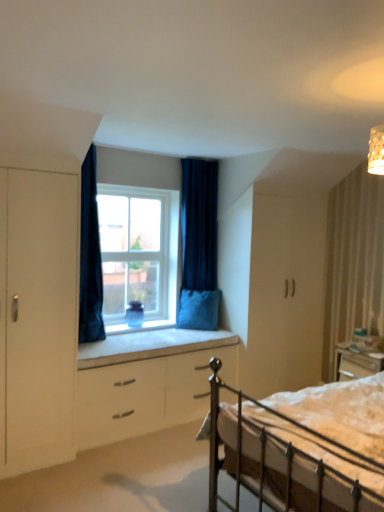
Question: From the image's perspective, is velvet dark blue curtain at center, which is the first curtain from back to front, above white cushioned window sill at center?

Choices:
 (A) no
 (B) yes

Answer: (B)

Question: Can you confirm if velvet dark blue curtain at center, the first curtain viewed from the right, is wider than white cushioned window sill at center?

Choices:
 (A) yes
 (B) no

Answer: (B)

Question: Could white cushioned window sill at center be considered to be inside velvet dark blue curtain at center, which is counted as the 2th curtain, starting from the front?

Choices:
 (A) yes
 (B) no

Answer: (B)

Question: Does velvet dark blue curtain at center, the second curtain from the left, have a greater height compared to white cushioned window sill at center?

Choices:
 (A) yes
 (B) no

Answer: (A)

Question: Is velvet dark blue curtain at center, which is the first curtain from back to front, oriented towards white cushioned window sill at center?

Choices:
 (A) no
 (B) yes

Answer: (A)

Question: Is velvet dark blue curtain at center, which is the first curtain from back to front, looking in the opposite direction of white cushioned window sill at center?

Choices:
 (A) yes
 (B) no

Answer: (B)

Question: Does metallic silver bed at lower right lie behind velvet dark blue curtain at center, the second curtain from the left?

Choices:
 (A) yes
 (B) no

Answer: (B)

Question: Is metallic silver bed at lower right taller than velvet dark blue curtain at center, the second curtain from the left?

Choices:
 (A) yes
 (B) no

Answer: (B)

Question: Is velvet dark blue curtain at center, which is the first curtain from back to front, a part of metallic silver bed at lower right?

Choices:
 (A) no
 (B) yes

Answer: (A)

Question: Is metallic silver bed at lower right outside velvet dark blue curtain at center, which is the first curtain from back to front?

Choices:
 (A) no
 (B) yes

Answer: (B)

Question: From a real-world perspective, is metallic silver bed at lower right located higher than velvet dark blue curtain at center, the first curtain viewed from the right?

Choices:
 (A) no
 (B) yes

Answer: (A)

Question: Considering the relative positions of metallic silver bed at lower right and velvet dark blue curtain at center, which is counted as the 2th curtain, starting from the front, in the image provided, is metallic silver bed at lower right to the left of velvet dark blue curtain at center, which is counted as the 2th curtain, starting from the front, from the viewer's perspective?

Choices:
 (A) yes
 (B) no

Answer: (B)

Question: Is velvet blue pillow at window wider than white cushioned window sill at center?

Choices:
 (A) yes
 (B) no

Answer: (B)